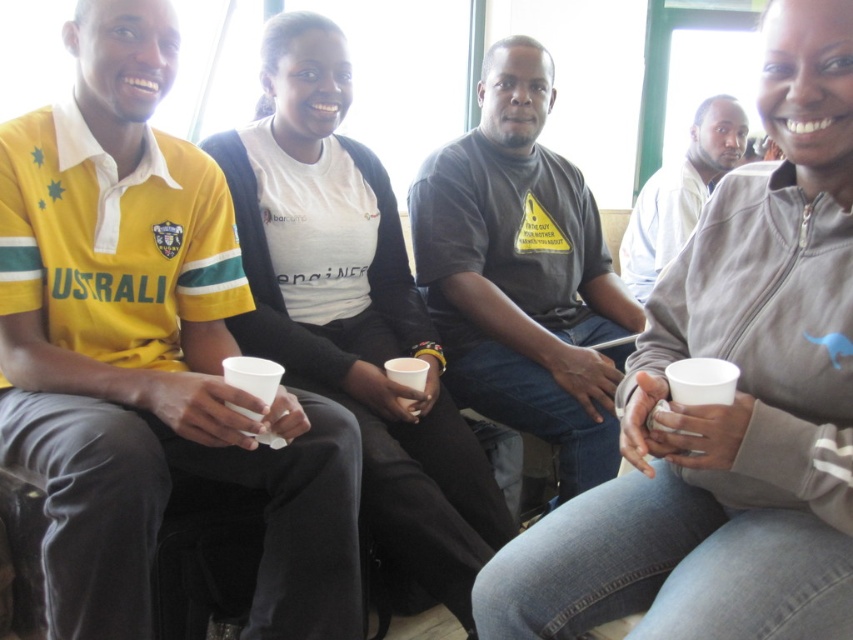
Question: Is yellow jersey at upper left below dark gray t-shirt at center?

Choices:
 (A) no
 (B) yes

Answer: (B)

Question: Which of the following is the closest to the observer?

Choices:
 (A) (677, 186)
 (B) (112, 300)

Answer: (B)

Question: Which object is farther from the camera taking this photo?

Choices:
 (A) white matte shirt at center
 (B) yellow jersey at upper left
 (C) dark gray t-shirt at center

Answer: (A)

Question: Which is farther from the dark gray t-shirt at center?

Choices:
 (A) white matte shirt at center
 (B) yellow jersey at upper left

Answer: (A)

Question: Does dark gray t-shirt at center have a smaller size compared to white matte shirt at center?

Choices:
 (A) no
 (B) yes

Answer: (A)

Question: Is the position of yellow jersey at upper left more distant than that of white matte shirt at center?

Choices:
 (A) yes
 (B) no

Answer: (B)